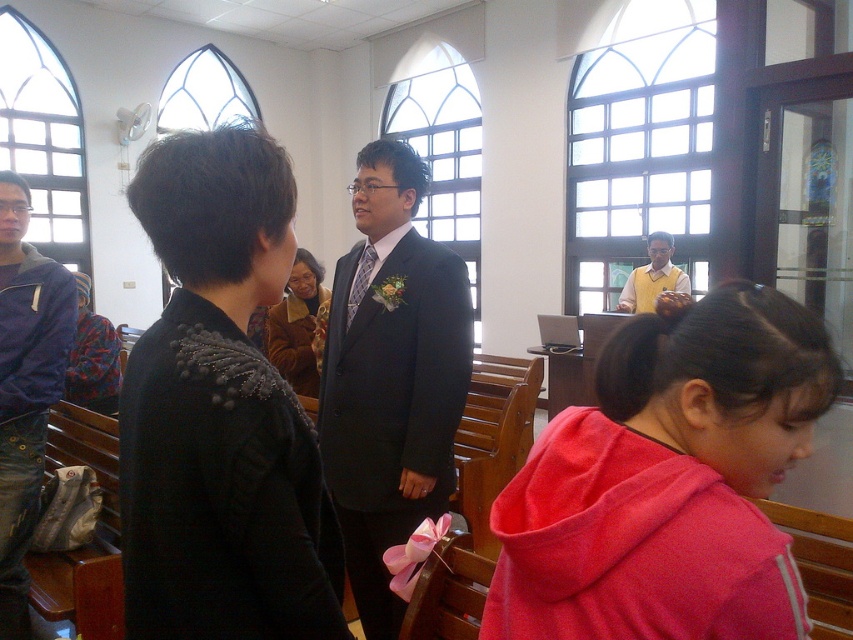
You are organizing a photo shoot and need to arrange two models wearing the matte black suit at center and the yellow matte vest at center. Based on their sizes, which model should stand in front to ensure both are visible in the photo?

The matte black suit at center has a smaller size compared to the yellow matte vest at center, so the model wearing the matte black suit at center should stand in front to ensure both are visible.

In the church scene, you see a pink fleece at lower right and a matte black suit at center. Which object is located to the right of the other?

The pink fleece at lower right is positioned on the right side of matte black suit at center.